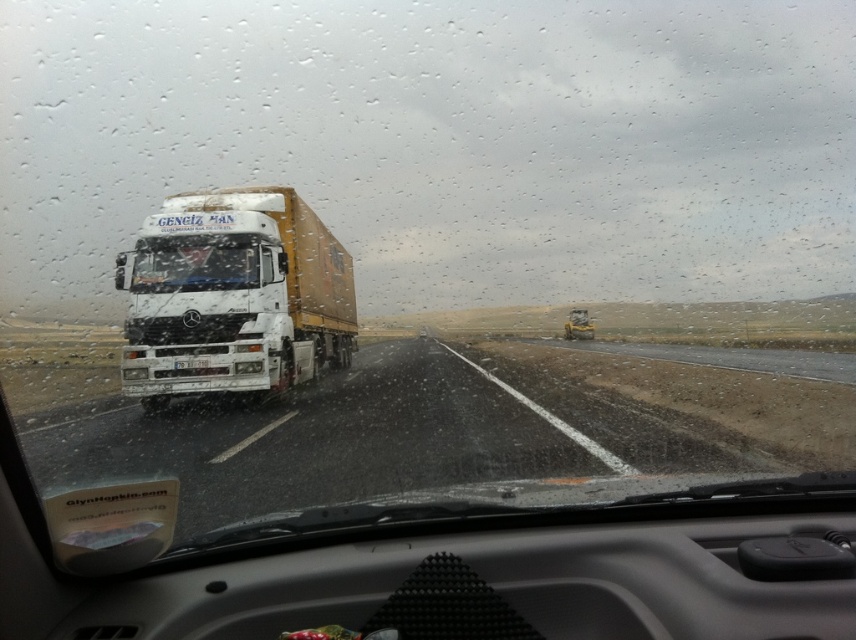
You are a passenger in the car and see two points on the windshield. The first point is at coordinate point (x=259, y=193) and the second is at point (x=242, y=269). Which point is closer to the edge of the windshield?

Point (x=242, y=269) is closer to the edge of the windshield because it has a lower y coordinate value compared to point (x=259, y=193).

You are driving a car and need to pass the white matte trailer truck at center. Since the transparent glass windshield at center is obstructed by raindrops, can you safely pass the truck using the space available through the windshield view?

The white matte trailer truck at center is wider than the transparent glass windshield at center, so passing might be risky as the truck is wider than the visible area through the windshield. Check the rearview mirror and ensure there is enough space before attempting to pass.

Looking at this image, you are driving a car and need to maintain a safe distance from the vehicle in front of you. The recommended safe distance is 6 meters. Based on the image, is the distance between the white matte trailer truck at center and the transparent glass windshield at center sufficient to meet the safe distance requirement?

The white matte trailer truck at center is 6.25 meters away from the transparent glass windshield at center. Since the recommended safe distance is 6 meters, the current distance of 6.25 meters exceeds the requirement, so it is sufficient.